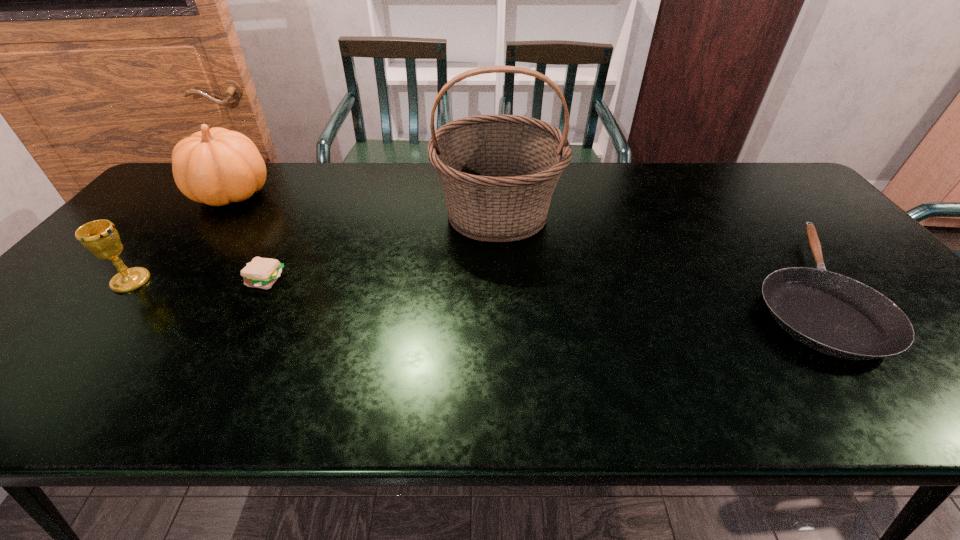
Identify the location of vacant space that is in between the rightmost object and the pumpkin. (517, 242).

You are a GUI agent. You are given a task and a screenshot of the screen. Output one action in this format:
    pyautogui.click(x=<x>, y=<y>)
    Task: Click on the free space between the rightmost object and the patty
    The width and height of the screenshot is (960, 540).
    Given the screenshot: What is the action you would take?
    pyautogui.click(x=534, y=285)

Select which object appears as the second closest to the third object from right to left. Please provide its 2D coordinates. Your answer should be formatted as a tuple, i.e. [(x, y)], where the tuple contains the x and y coordinates of a point satisfying the conditions above.

[(100, 237)]

Locate which object is the fourth closest to the basket. Please provide its 2D coordinates. Your answer should be formatted as a tuple, i.e. [(x, y)], where the tuple contains the x and y coordinates of a point satisfying the conditions above.

[(100, 237)]

At what (x,y) coordinates should I click in order to perform the action: click on vacant space that satisfies the following two spatial constraints: 1. on the back side of the third tallest object; 2. on the right side of the pumpkin. Please return your answer as a coordinate pair (x, y). The image size is (960, 540). Looking at the image, I should click on (204, 194).

I want to click on vacant area in the image that satisfies the following two spatial constraints: 1. on the front side of the rightmost object; 2. on the left side of the tallest object, so click(501, 290).